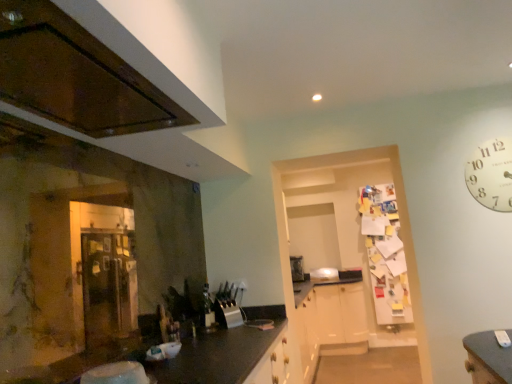
Question: Considering the relative sizes of satin silver toaster at center and glossy wood cabinetry at upper left in the image provided, is satin silver toaster at center taller than glossy wood cabinetry at upper left?

Choices:
 (A) yes
 (B) no

Answer: (A)

Question: Considering the relative sizes of satin silver toaster at center and glossy wood cabinetry at upper left in the image provided, is satin silver toaster at center shorter than glossy wood cabinetry at upper left?

Choices:
 (A) no
 (B) yes

Answer: (A)

Question: Considering the relative sizes of satin silver toaster at center and glossy wood cabinetry at upper left in the image provided, is satin silver toaster at center smaller than glossy wood cabinetry at upper left?

Choices:
 (A) no
 (B) yes

Answer: (A)

Question: Is glossy wood cabinetry at upper left surrounded by satin silver toaster at center?

Choices:
 (A) yes
 (B) no

Answer: (B)

Question: Is satin silver toaster at center positioned far away from glossy wood cabinetry at upper left?

Choices:
 (A) no
 (B) yes

Answer: (B)

Question: From the image's perspective, is satin silver toaster at center on glossy wood cabinetry at upper left?

Choices:
 (A) yes
 (B) no

Answer: (B)

Question: Can you confirm if satin silver toaster at center is bigger than white paper clock at upper right?

Choices:
 (A) yes
 (B) no

Answer: (A)

Question: From the image's perspective, does satin silver toaster at center appear lower than white paper clock at upper right?

Choices:
 (A) no
 (B) yes

Answer: (B)

Question: Is satin silver toaster at center further to the viewer compared to white paper clock at upper right?

Choices:
 (A) no
 (B) yes

Answer: (B)

Question: Is satin silver toaster at center thinner than white paper clock at upper right?

Choices:
 (A) no
 (B) yes

Answer: (A)

Question: Is the surface of satin silver toaster at center in direct contact with white paper clock at upper right?

Choices:
 (A) no
 (B) yes

Answer: (A)

Question: Is satin silver toaster at center taller than white paper clock at upper right?

Choices:
 (A) no
 (B) yes

Answer: (A)

Question: Is white paper clock at upper right in front of satin silver toaster at center?

Choices:
 (A) yes
 (B) no

Answer: (A)